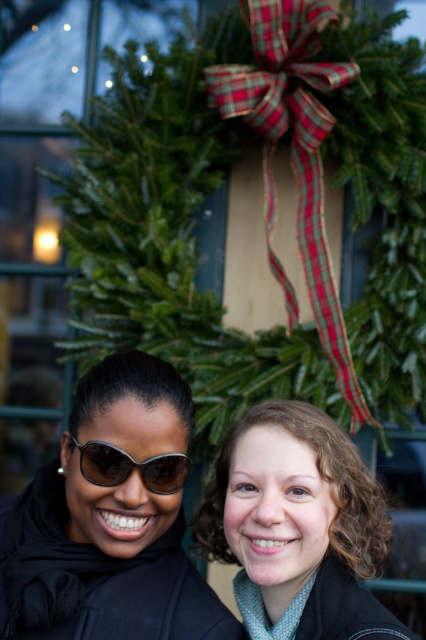
Describe the element at coordinates (301, 520) in the screenshot. Image resolution: width=426 pixels, height=640 pixels. I see `curly brown hair at center` at that location.

Which is above, curly brown hair at center or sunglasses at center?

sunglasses at center is higher up.

Is point (342, 634) positioned before point (92, 440)?

That is True.

Image resolution: width=426 pixels, height=640 pixels. I want to click on curly brown hair at center, so click(x=301, y=520).

Is point (51, 630) closer to camera compared to point (86, 465)?

No, it is behind (86, 465).

How much distance is there between matte black sunglasses at center and sunglasses at center?

They are 5.05 inches apart.

Based on the photo, who is more forward, (74, 515) or (115, 456)?

Positioned in front is point (115, 456).

The image size is (426, 640). I want to click on matte black sunglasses at center, so click(x=109, y=524).

Between matte black sunglasses at center and curly brown hair at center, which one has less height?

curly brown hair at center

Which is more to the right, matte black sunglasses at center or curly brown hair at center?

curly brown hair at center is more to the right.

Is point (94, 429) positioned before point (308, 484)?

Yes, point (94, 429) is in front of point (308, 484).

At what (x,y) coordinates should I click in order to perform the action: click on matte black sunglasses at center. Please return your answer as a coordinate pair (x, y). Image resolution: width=426 pixels, height=640 pixels. Looking at the image, I should click on (109, 524).